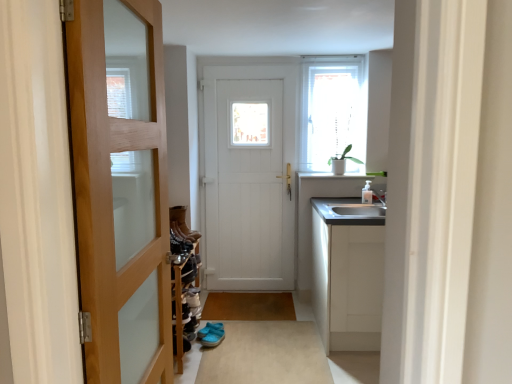
Image resolution: width=512 pixels, height=384 pixels. In order to click on free spot above brown matte mat at center, the 1th plain viewed from the top (from a real-world perspective) in this screenshot , I will do `click(240, 297)`.